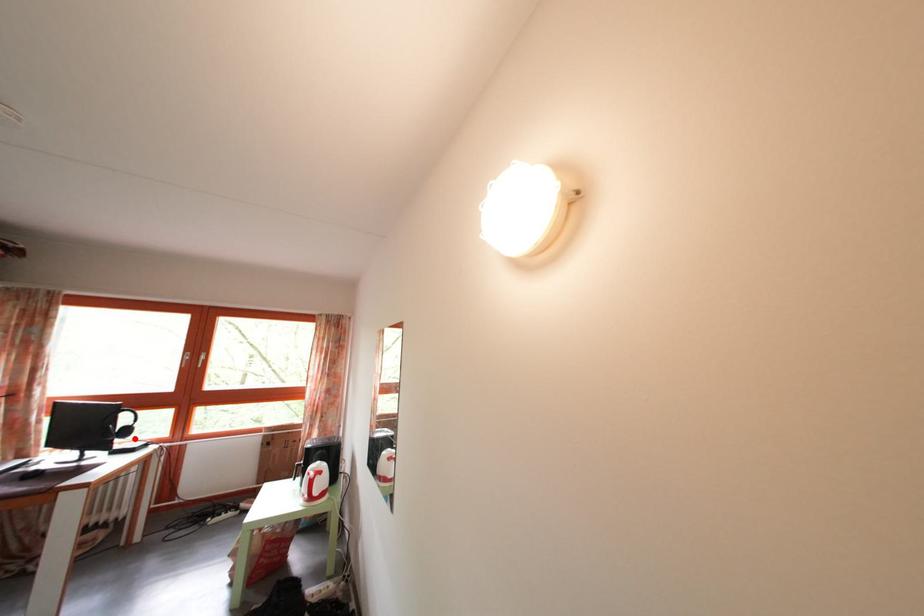
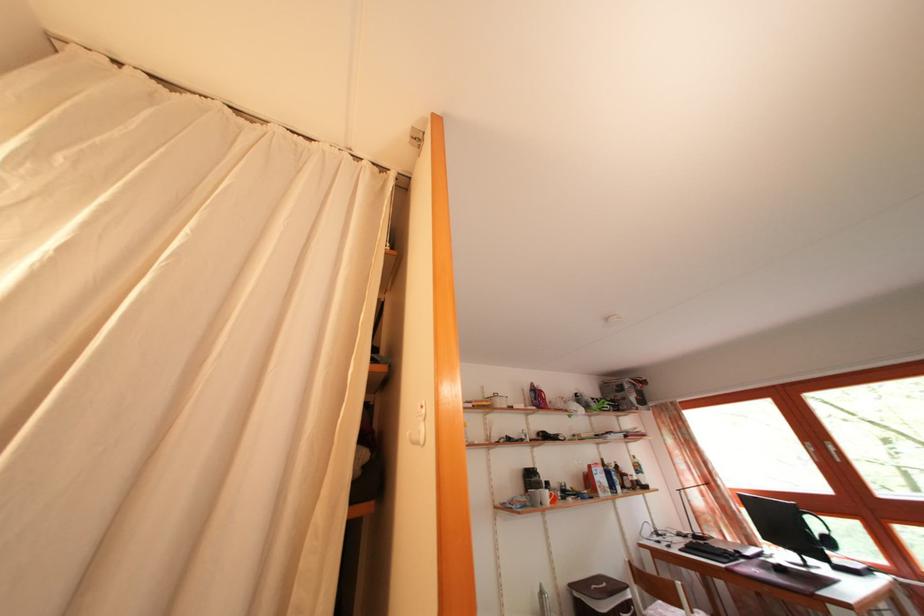
The point at the highlighted location is marked in the first image. Where is the corresponding point in the second image?

(837, 549)